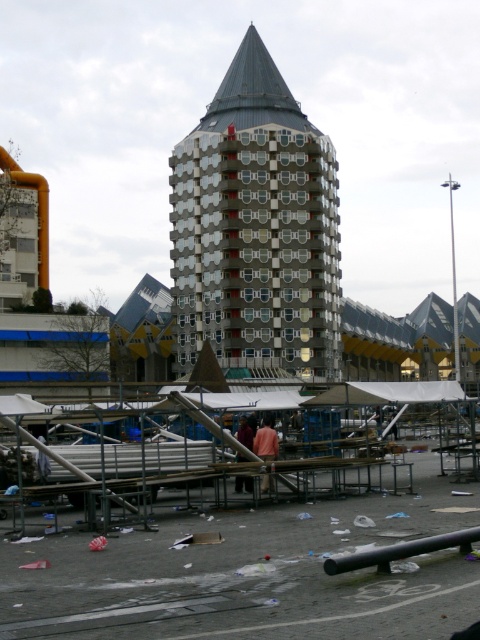
Question: From the image, what is the correct spatial relationship of metal scaffolding at center in relation to metallic gray building at center?

Choices:
 (A) right
 (B) left

Answer: (A)

Question: Does metal scaffolding at center appear under metallic gray building at center?

Choices:
 (A) no
 (B) yes

Answer: (B)

Question: Which object appears closest to the camera in this image?

Choices:
 (A) metal scaffolding at center
 (B) metallic gray building at center

Answer: (A)

Question: Is metal scaffolding at center in front of metallic gray building at center?

Choices:
 (A) no
 (B) yes

Answer: (B)